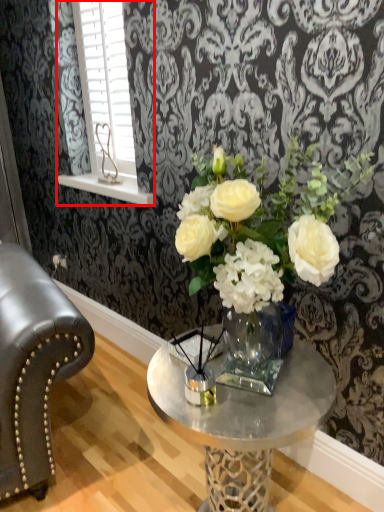
Question: From the image's perspective, considering the relative positions of window (annotated by the red box) and coffee table in the image provided, where is window (annotated by the red box) located with respect to the staircase?

Choices:
 (A) below
 (B) above

Answer: (B)